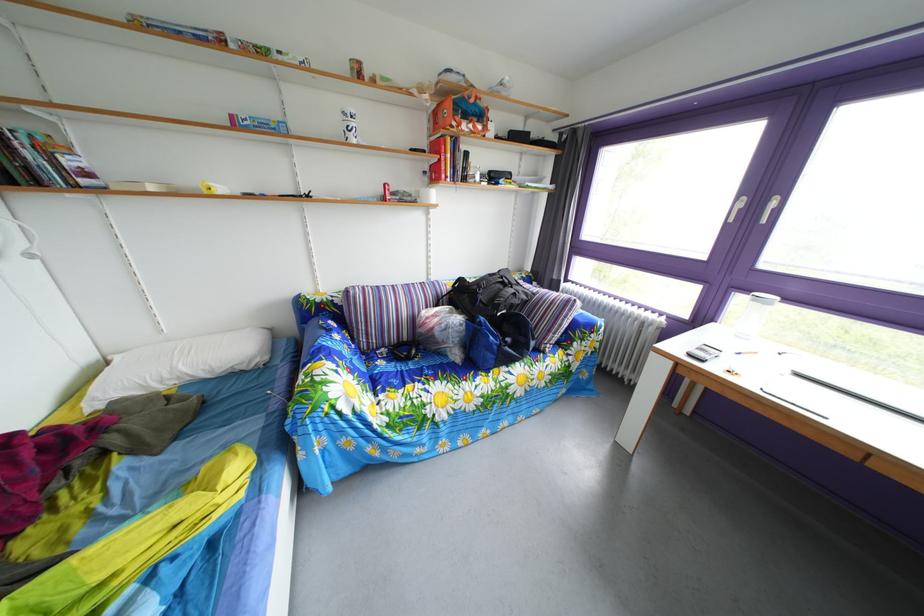
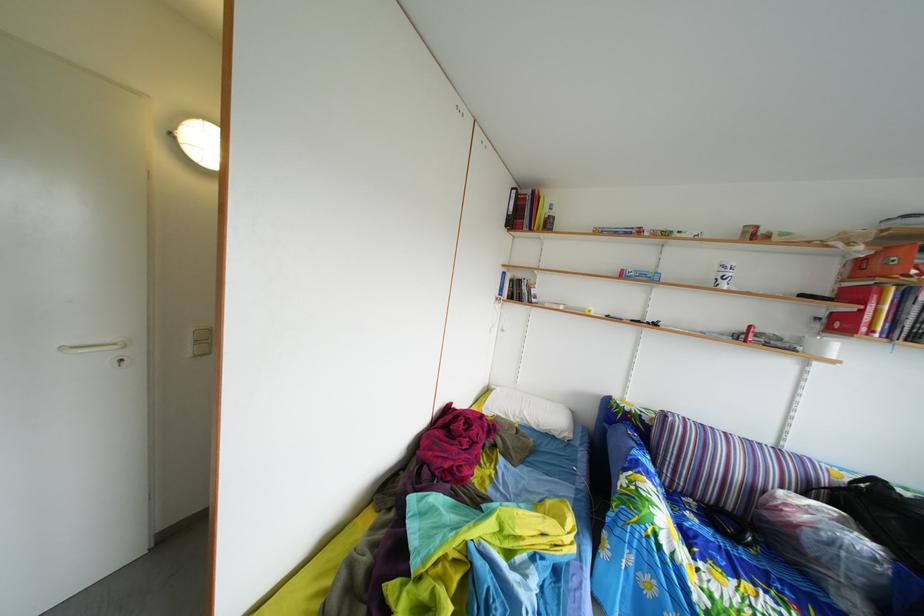
Question: Based on the continuous images, in which direction is the camera rotating? Reply with the corresponding letter.

Choices:
 (A) Left
 (B) Right
 (C) Up
 (D) Down

Answer: (A)